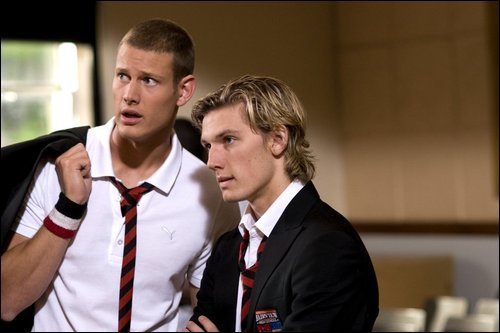
At what (x,y) coordinates should I click in order to perform the action: click on wall. Please return your answer as a coordinate pair (x, y). The height and width of the screenshot is (333, 500). Looking at the image, I should click on (411, 201).